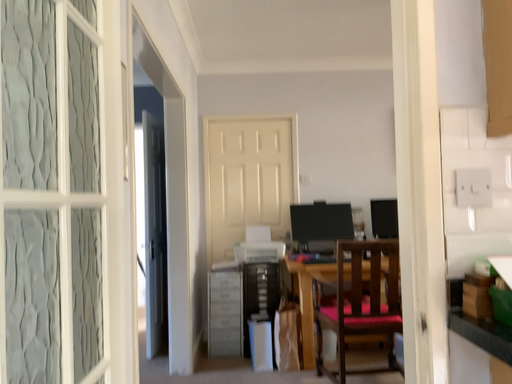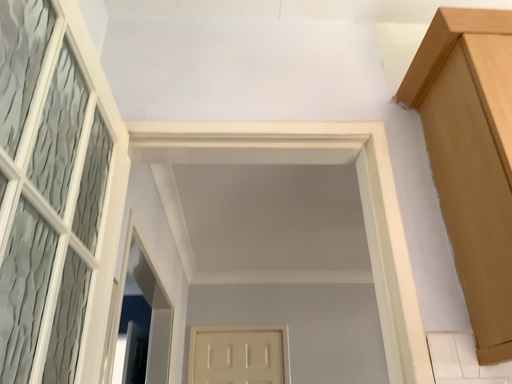
Question: Which way did the camera rotate in the video?

Choices:
 (A) rotated downward
 (B) rotated upward

Answer: (B)